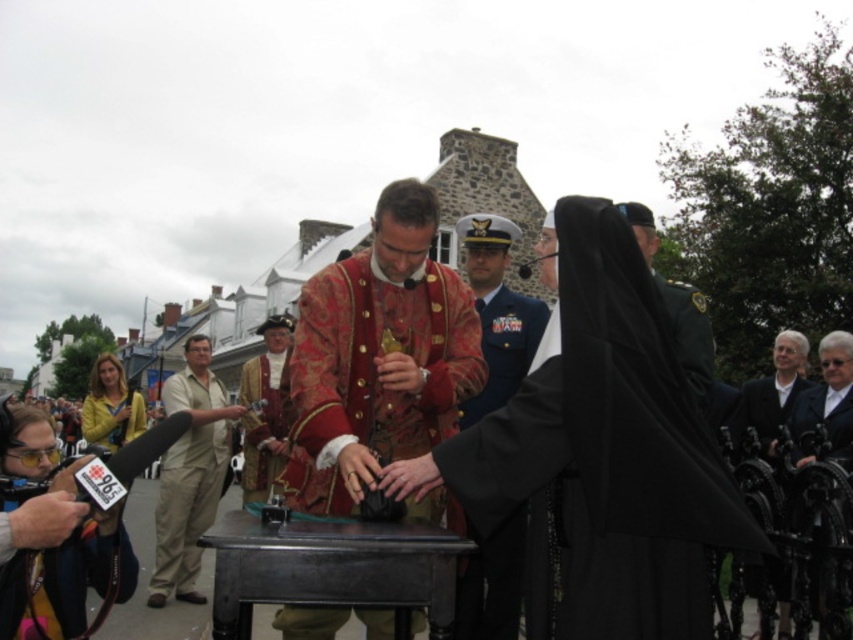
You are a participant in the reenactment and need to move from the starting position at point (x=521, y=561) to the historical performer at point (x=436, y=220). Is the performer in front of or behind your current position?

The performer at point (x=436, y=220) is behind your current position at point (x=521, y=561) according to the coordinates provided.

What is the position of the point labeled as point (607, 454) in the image?

The point labeled as point (607, 454) is located on the black matte robe at center.